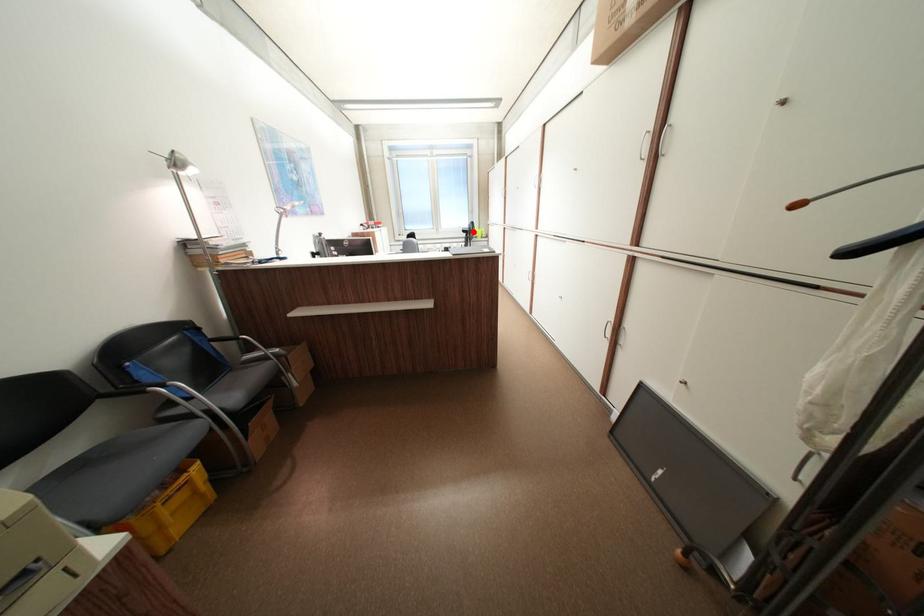
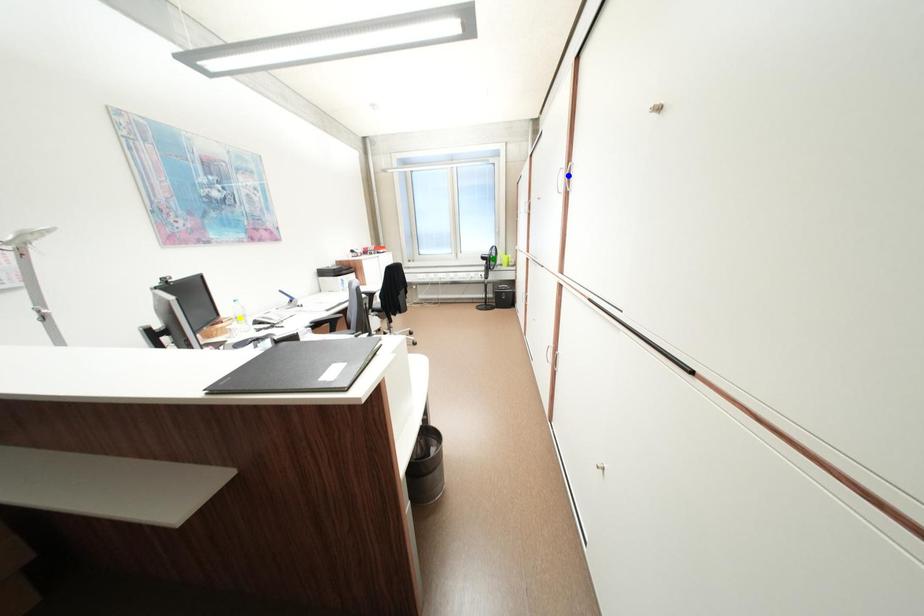
Question: I am providing you with two images of the same scene from different viewpoints. A red point is marked on the first image. You are given multiple points on the second image. Which point in image 2 represents the same 3d spot as the red point in image 1?

Choices:
 (A) blue point
 (B) yellow point
 (C) green point

Answer: (C)